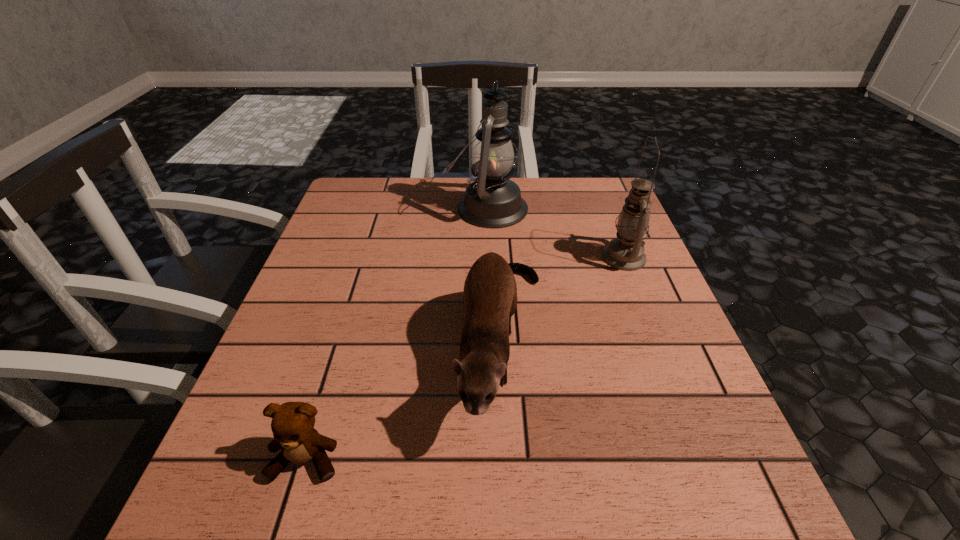
Locate an element on the screen. free space at the near left corner of the desktop is located at coordinates (239, 489).

Find the location of a particular element. free space at the far right corner is located at coordinates [x=567, y=206].

The image size is (960, 540). I want to click on free spot between the farthest object and the leftmost object, so click(396, 334).

The height and width of the screenshot is (540, 960). Find the location of `empty space that is in between the ferret and the leftmost object`. empty space that is in between the ferret and the leftmost object is located at coordinates (404, 402).

Where is `empty location between the teddy bear and the third tallest object`? empty location between the teddy bear and the third tallest object is located at coordinates (404, 402).

This screenshot has height=540, width=960. I want to click on vacant region between the ferret and the nearer oil lamp, so click(x=563, y=301).

Find the location of a particular element. The height and width of the screenshot is (540, 960). free space between the rightmost object and the third tallest object is located at coordinates (563, 301).

Locate an element on the screen. The image size is (960, 540). vacant point located between the third tallest object and the rightmost object is located at coordinates (563, 301).

Identify the location of free area in between the nearer oil lamp and the farther oil lamp. (555, 233).

At what (x,y) coordinates should I click in order to perform the action: click on object that is the second closest to the farthest object. Please return your answer as a coordinate pair (x, y). Looking at the image, I should click on (625, 252).